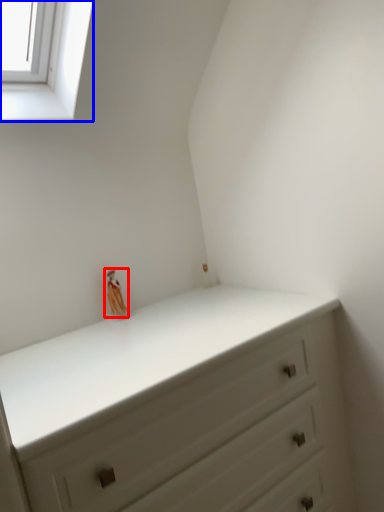
Question: Which object appears closest to the camera in this image, miniature (highlighted by a red box) or window (highlighted by a blue box)?

Choices:
 (A) miniature
 (B) window

Answer: (B)